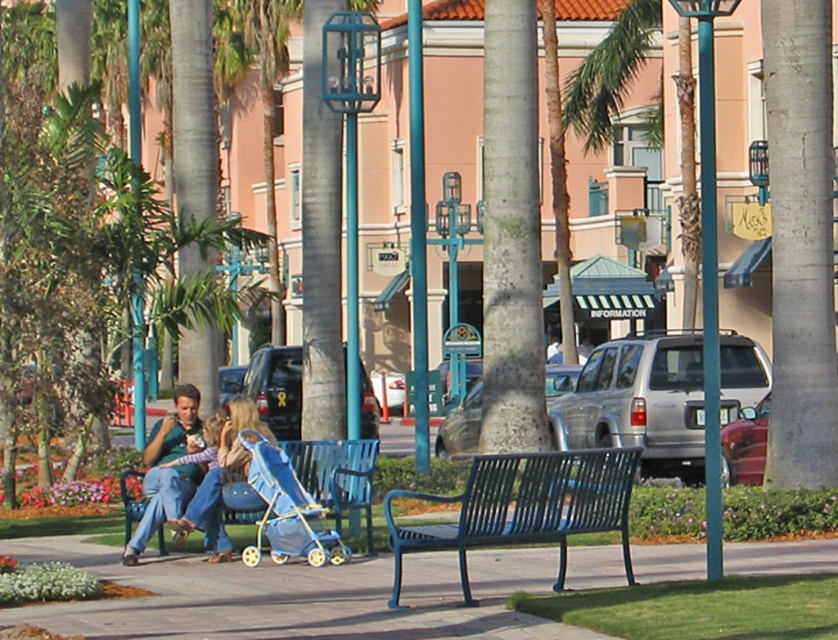
You are a parent with a toddler who needs to sit down. You see the blue plastic bench at center and the matte blue jeans at center. Which object is shorter and thus more suitable for your toddler to sit on?

The blue plastic bench at center is shorter than the matte blue jeans at center, making it more suitable for your toddler to sit on.

You are standing in the park and want to walk towards both the point at coordinates [80,538] and the point at [340,476]. Which point will you reach first?

You will reach point [80,538] first because it is closer to you than point [340,476], which is further away.

You are a delivery person who needs to place a heavy box on the ground in the park. The box must be placed exactly at point (296, 596). What type of surface is at that point?

The surface at point (296, 596) is smooth concrete pavement at center, so you can safely place the heavy box there.